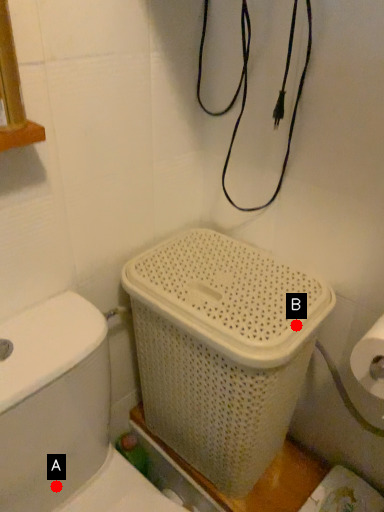
Question: Two points are circled on the image, labeled by A and B beside each circle. Which point is farther to the camera?

Choices:
 (A) A is further
 (B) B is further

Answer: (A)